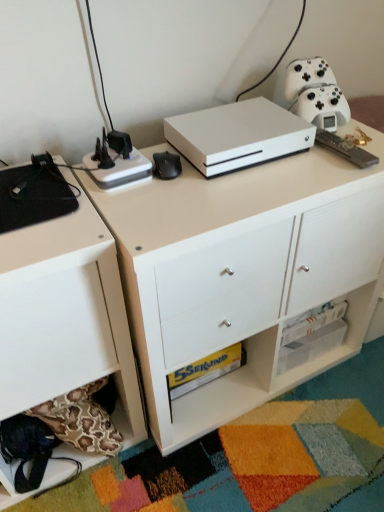
Question: Is white matte game controller at upper right, which ranks as the 1th appliance in right-to-left order, turned away from black matte mouse pad at left, marked as the fourth appliance in a right-to-left arrangement?

Choices:
 (A) no
 (B) yes

Answer: (A)

Question: Is white matte game controller at upper right, which ranks as the 1th appliance in right-to-left order, taller than black matte mouse pad at left, marked as the fourth appliance in a right-to-left arrangement?

Choices:
 (A) yes
 (B) no

Answer: (A)

Question: From the image's perspective, is white matte game controller at upper right, which ranks as the 1th appliance in right-to-left order, over black matte mouse pad at left, which is the 1th appliance in left-to-right order?

Choices:
 (A) yes
 (B) no

Answer: (A)

Question: Is white matte game controller at upper right, which ranks as the 1th appliance in right-to-left order, at the right side of black matte mouse pad at left, marked as the fourth appliance in a right-to-left arrangement?

Choices:
 (A) yes
 (B) no

Answer: (A)

Question: Does white matte game controller at upper right, the fourth appliance from the left, contain black matte mouse pad at left, marked as the fourth appliance in a right-to-left arrangement?

Choices:
 (A) yes
 (B) no

Answer: (B)

Question: Is white matte game controller at upper right, the fourth appliance from the left, far from black matte mouse pad at left, marked as the fourth appliance in a right-to-left arrangement?

Choices:
 (A) yes
 (B) no

Answer: (B)

Question: Can you confirm if black matte mouse pad at left, marked as the fourth appliance in a right-to-left arrangement, is wider than white matte xbox one s at center?

Choices:
 (A) yes
 (B) no

Answer: (B)

Question: From a real-world perspective, does black matte mouse pad at left, marked as the fourth appliance in a right-to-left arrangement, sit lower than white matte xbox one s at center?

Choices:
 (A) no
 (B) yes

Answer: (A)

Question: Is white matte xbox one s at center a part of black matte mouse pad at left, which is the 1th appliance in left-to-right order?

Choices:
 (A) no
 (B) yes

Answer: (A)

Question: Considering the relative positions of black matte mouse pad at left, which is the 1th appliance in left-to-right order, and white matte xbox one s at center in the image provided, is black matte mouse pad at left, which is the 1th appliance in left-to-right order, in front of white matte xbox one s at center?

Choices:
 (A) no
 (B) yes

Answer: (A)

Question: Can you confirm if black matte mouse pad at left, marked as the fourth appliance in a right-to-left arrangement, is shorter than white matte xbox one s at center?

Choices:
 (A) yes
 (B) no

Answer: (A)

Question: Is black matte mouse pad at left, marked as the fourth appliance in a right-to-left arrangement, not close to white matte xbox one s at center?

Choices:
 (A) yes
 (B) no

Answer: (B)

Question: Is white matte gaming console at center, which is the 2th appliance in right-to-left order, to the left of white matte chest of drawers at lower left from the viewer's perspective?

Choices:
 (A) yes
 (B) no

Answer: (B)